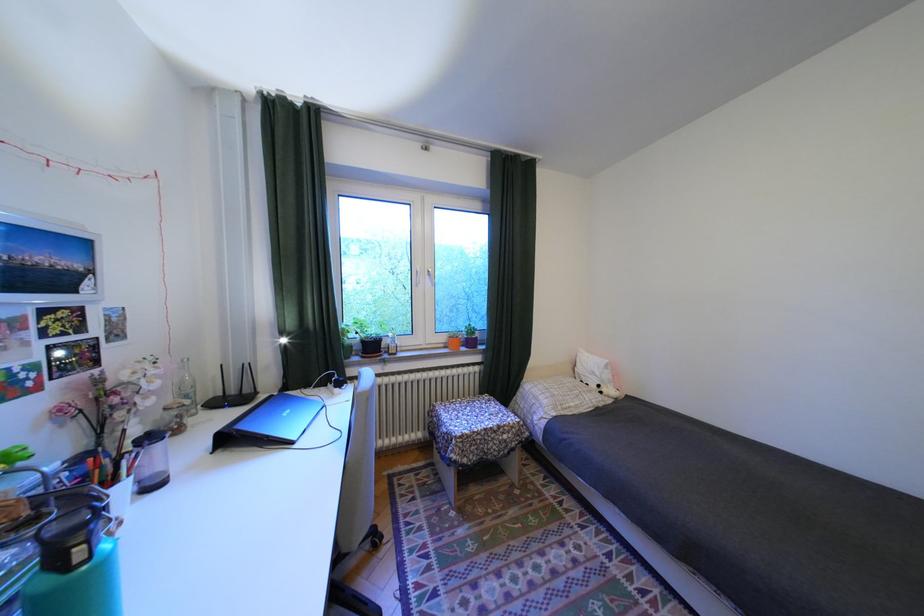
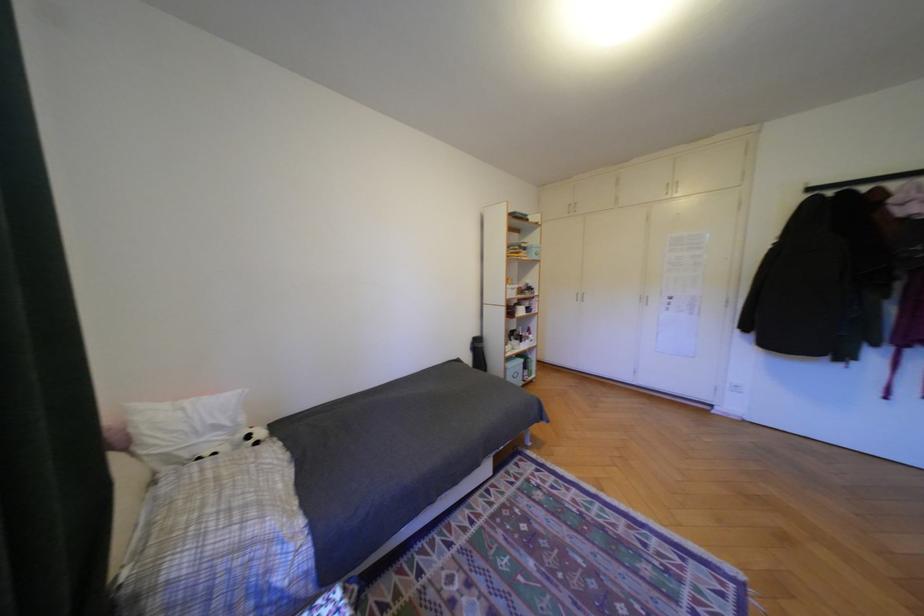
In the second image, find the point that corresponds to the point at 605,374 in the first image.

(228, 427)